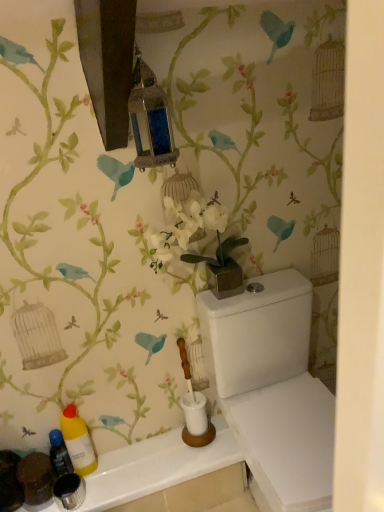
Question: Is white glossy counter top at lower left wider or thinner than translucent plastic bottle at lower left, the first bottle viewed from the left?

Choices:
 (A) thin
 (B) wide

Answer: (B)

Question: Visually, is white glossy counter top at lower left positioned to the left or to the right of translucent plastic bottle at lower left, the first bottle viewed from the left?

Choices:
 (A) right
 (B) left

Answer: (A)

Question: Estimate the real-world distances between objects in this image. Which object is closer to the white glossy counter top at lower left?

Choices:
 (A) yellow matte bottle at lower left, which is counted as the second bottle, starting from the left
 (B) translucent plastic bottle at lower left, the 2th bottle when ordered from right to left
 (C) white glossy porcelain at lower right

Answer: (A)

Question: Which object is the closest to the white glossy counter top at lower left?

Choices:
 (A) yellow matte bottle at lower left, placed as the first bottle when sorted from right to left
 (B) translucent plastic bottle at lower left, the first bottle viewed from the left
 (C) white glossy porcelain at lower right

Answer: (A)